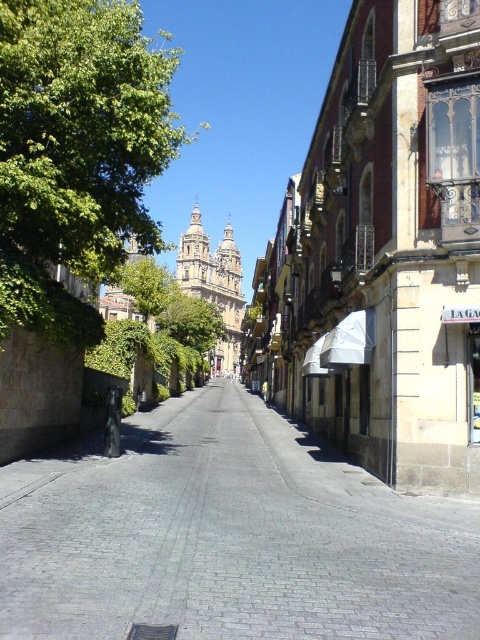
Consider the image. Does gray cobblestone pavement at center have a larger size compared to green leafy tree at upper left?

Actually, gray cobblestone pavement at center might be smaller than green leafy tree at upper left.

Is gray cobblestone pavement at center taller than green leafy tree at upper left?

Incorrect, gray cobblestone pavement at center's height is not larger of green leafy tree at upper left's.

Is point (175, 582) positioned in front of point (68, 300)?

Yes, point (175, 582) is in front of point (68, 300).

The width and height of the screenshot is (480, 640). I want to click on gray cobblestone pavement at center, so click(228, 536).